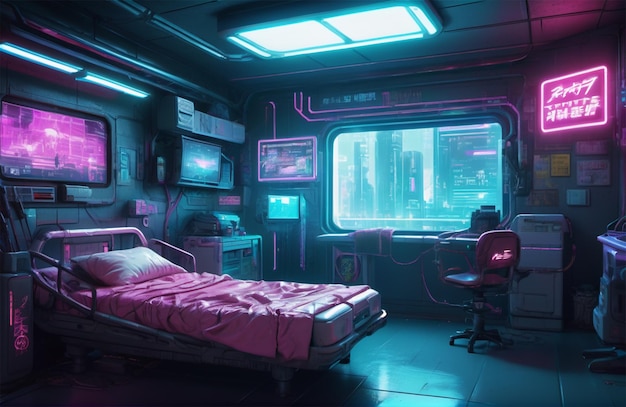
You are a GUI agent. You are given a task and a screenshot of the screen. Output one action in this format:
    pyautogui.click(x=<x>, y=<y>)
    Task: Click on the moniter
    The width and height of the screenshot is (626, 407).
    Given the screenshot: What is the action you would take?
    pyautogui.click(x=203, y=167)